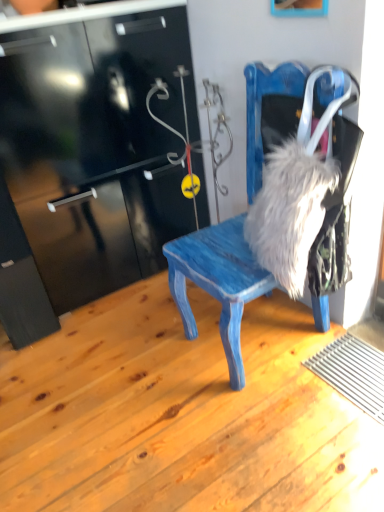
Question: From the image's perspective, is blue painted wood chair at center under wooden picture frame at upper center?

Choices:
 (A) yes
 (B) no

Answer: (A)

Question: Is blue painted wood chair at center taller than wooden picture frame at upper center?

Choices:
 (A) no
 (B) yes

Answer: (B)

Question: Considering the relative sizes of blue painted wood chair at center and wooden picture frame at upper center in the image provided, is blue painted wood chair at center shorter than wooden picture frame at upper center?

Choices:
 (A) yes
 (B) no

Answer: (B)

Question: Is blue painted wood chair at center further to camera compared to wooden picture frame at upper center?

Choices:
 (A) no
 (B) yes

Answer: (A)

Question: From the image's perspective, is blue painted wood chair at center above wooden picture frame at upper center?

Choices:
 (A) no
 (B) yes

Answer: (A)

Question: Is blue painted wood chair at center bigger or smaller than fuzzy gray fur at right?

Choices:
 (A) big
 (B) small

Answer: (A)

Question: From the image's perspective, relative to fuzzy gray fur at right, is blue painted wood chair at center above or below?

Choices:
 (A) below
 (B) above

Answer: (B)

Question: Considering the positions of blue painted wood chair at center and fuzzy gray fur at right in the image, is blue painted wood chair at center taller or shorter than fuzzy gray fur at right?

Choices:
 (A) short
 (B) tall

Answer: (B)

Question: Visually, is blue painted wood chair at center positioned to the left or to the right of fuzzy gray fur at right?

Choices:
 (A) left
 (B) right

Answer: (A)

Question: Based on their positions, is blue painted wood chair at center located to the left or right of wooden picture frame at upper center?

Choices:
 (A) right
 (B) left

Answer: (B)

Question: From a real-world perspective, is blue painted wood chair at center physically located above or below wooden picture frame at upper center?

Choices:
 (A) above
 (B) below

Answer: (B)

Question: From their relative heights in the image, would you say blue painted wood chair at center is taller or shorter than wooden picture frame at upper center?

Choices:
 (A) short
 (B) tall

Answer: (B)

Question: From the image's perspective, is blue painted wood chair at center located above or below wooden picture frame at upper center?

Choices:
 (A) above
 (B) below

Answer: (B)

Question: Considering their positions, is wooden picture frame at upper center located in front of or behind fuzzy gray fur at right?

Choices:
 (A) front
 (B) behind

Answer: (A)

Question: Is wooden picture frame at upper center taller or shorter than fuzzy gray fur at right?

Choices:
 (A) short
 (B) tall

Answer: (A)